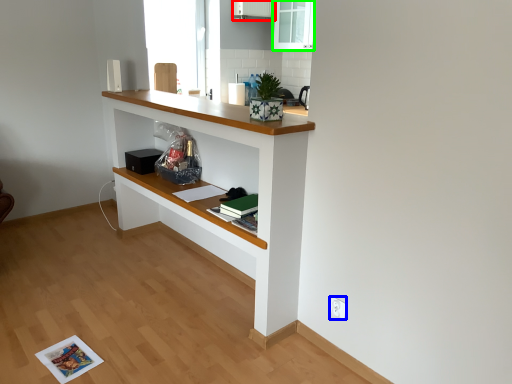
Question: Estimate the real-world distances between objects in this image. Which object is closer to cabinetry (highlighted by a red box), electric outlet (highlighted by a blue box) or glass door (highlighted by a green box)?

Choices:
 (A) electric outlet
 (B) glass door

Answer: (B)